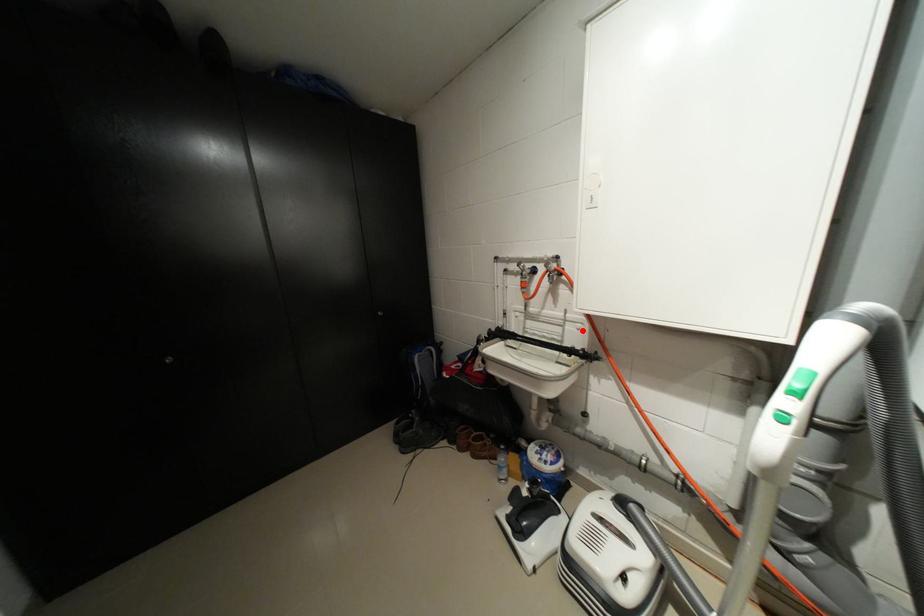
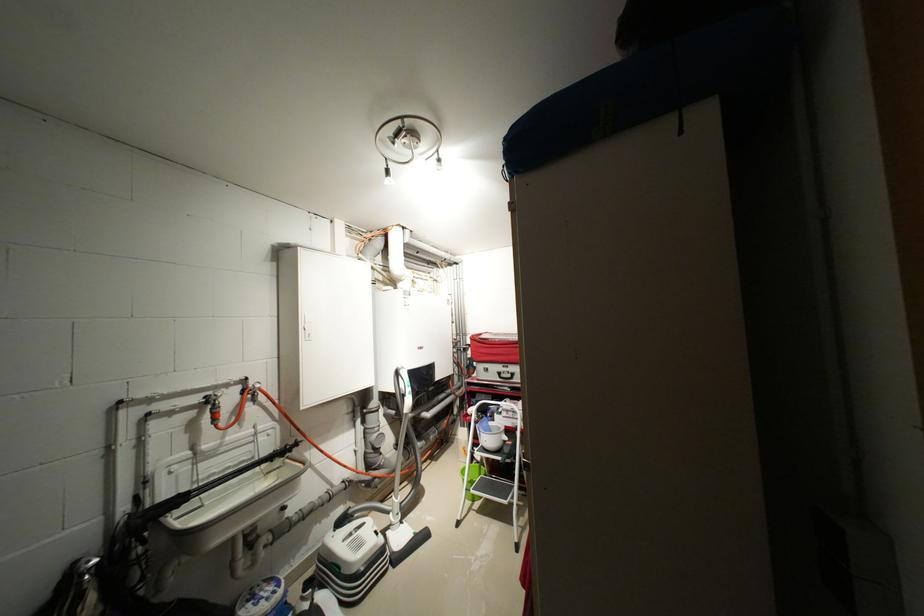
The point at the highlighted location is marked in the first image. Where is the corresponding point in the second image?

(273, 439)